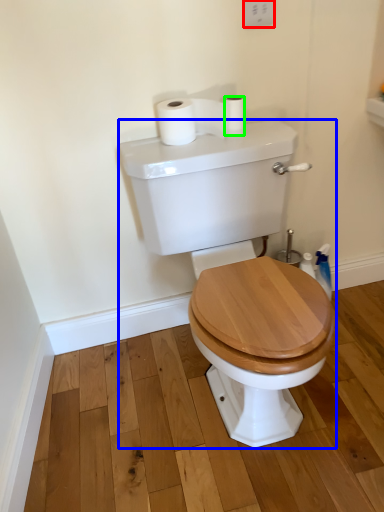
Question: Which is farther away from electric outlet (highlighted by a red box)? porcelain (highlighted by a blue box) or toilet paper (highlighted by a green box)?

Choices:
 (A) porcelain
 (B) toilet paper

Answer: (A)